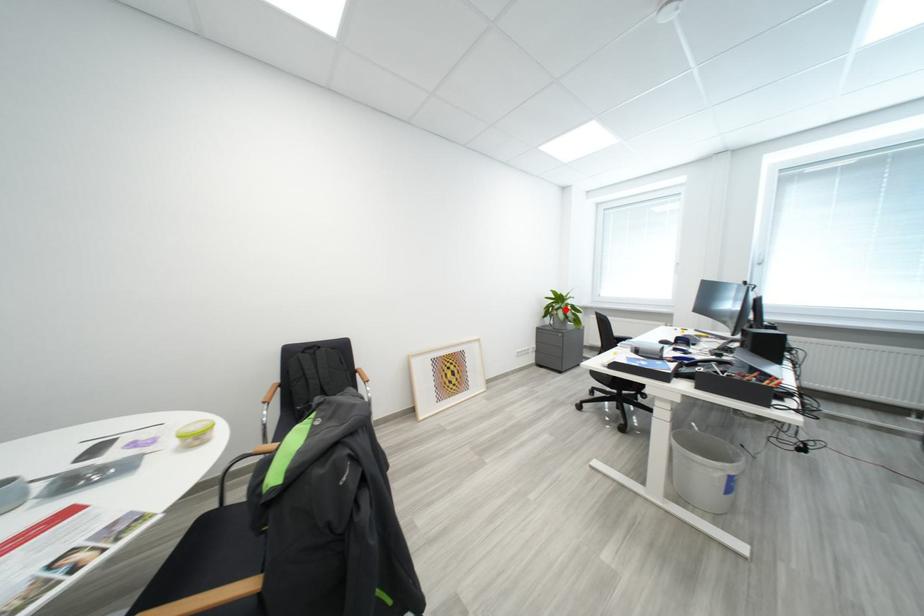
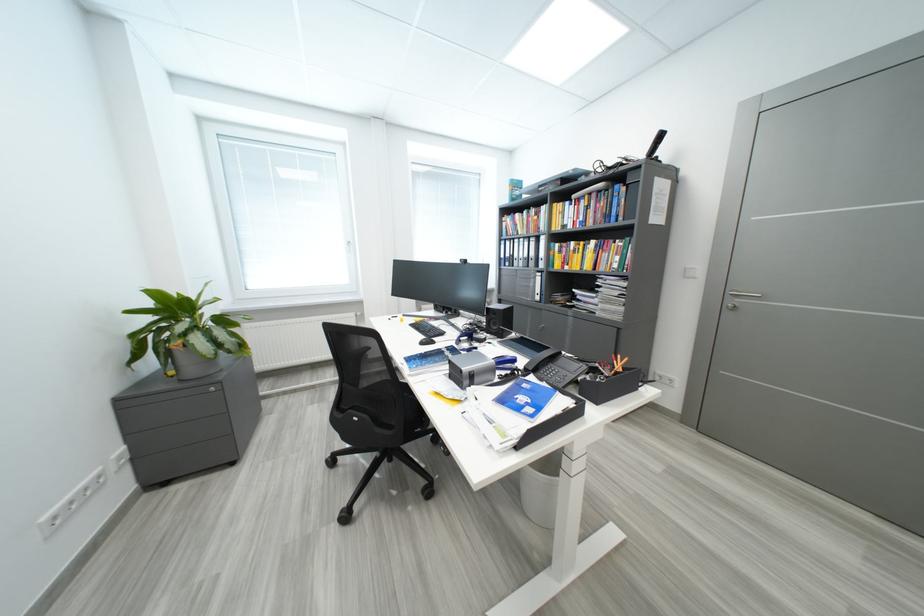
Find the pixel in the second image that matches the highlighted location in the first image.

(189, 331)